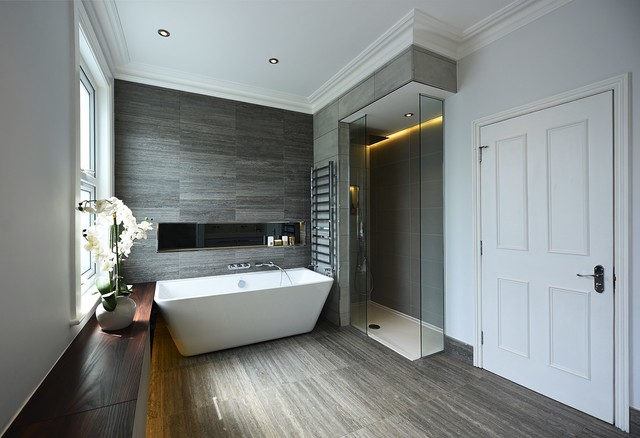
This screenshot has height=438, width=640. Identify the location of white bathtub. (237, 313).